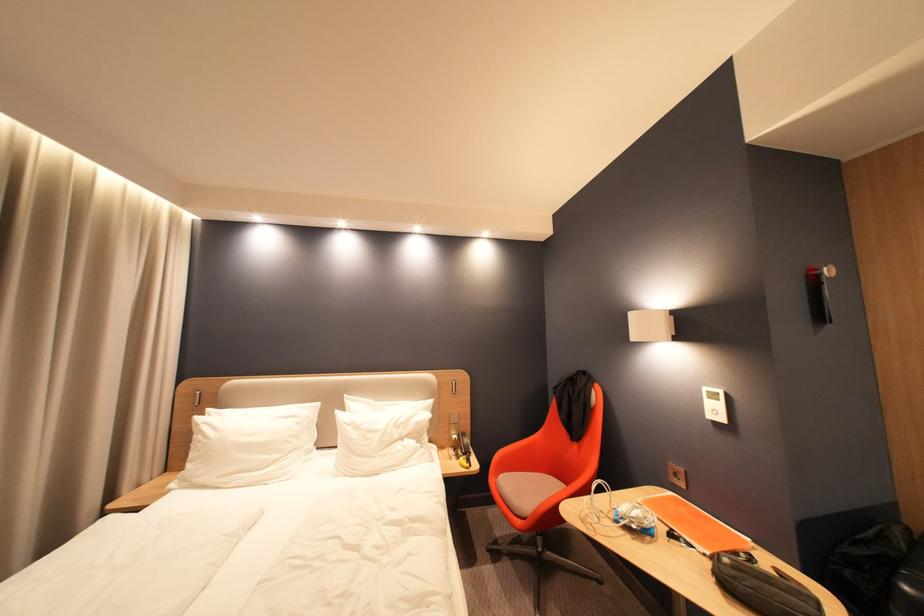
Describe the element at coordinates (819, 293) in the screenshot. I see `a wall coat hook` at that location.